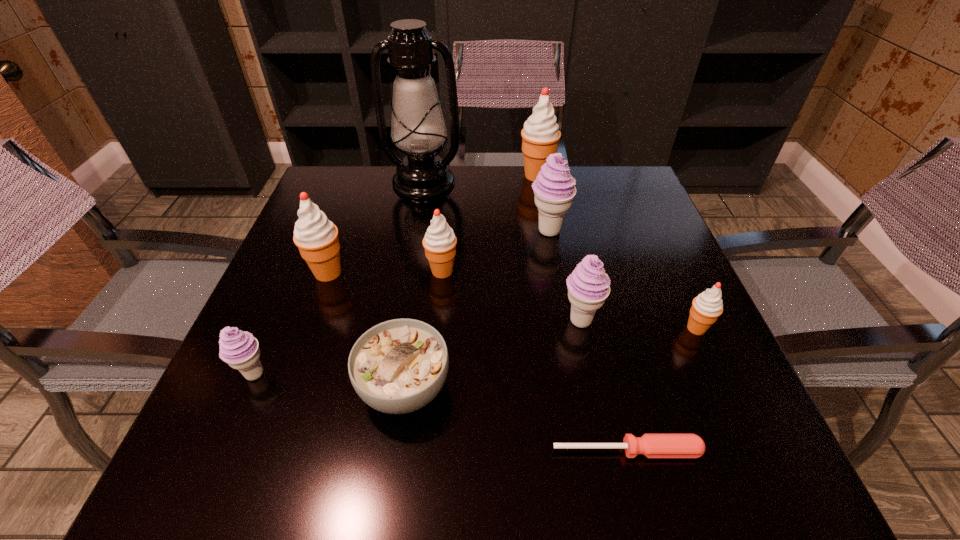
At what (x,y) coordinates should I click in order to perform the action: click on object that is at the near edge. Please return your answer as a coordinate pair (x, y). Looking at the image, I should click on (650, 445).

Locate an element on the screen. The width and height of the screenshot is (960, 540). icecream present at the right edge is located at coordinates (706, 308).

Where is `screwdriver located in the right edge section of the desktop`? The image size is (960, 540). screwdriver located in the right edge section of the desktop is located at coordinates (650, 445).

The height and width of the screenshot is (540, 960). Find the location of `object at the near right corner`. object at the near right corner is located at coordinates (650, 445).

In the image, there is a desktop. At what (x,y) coordinates should I click in order to perform the action: click on vacant region at the far edge. Please return your answer as a coordinate pair (x, y). This screenshot has width=960, height=540. Looking at the image, I should click on (458, 174).

Locate an element on the screen. This screenshot has width=960, height=540. vacant space at the near edge of the desktop is located at coordinates pyautogui.click(x=516, y=440).

Where is `vacant space at the left edge`? The height and width of the screenshot is (540, 960). vacant space at the left edge is located at coordinates (292, 256).

In the image, there is a desktop. Where is `free space at the right edge`? free space at the right edge is located at coordinates (654, 287).

In the image, there is a desktop. Identify the location of vacant space at the far left corner. (319, 193).

Where is `vacant region at the near right corner of the desktop`? The image size is (960, 540). vacant region at the near right corner of the desktop is located at coordinates (679, 488).